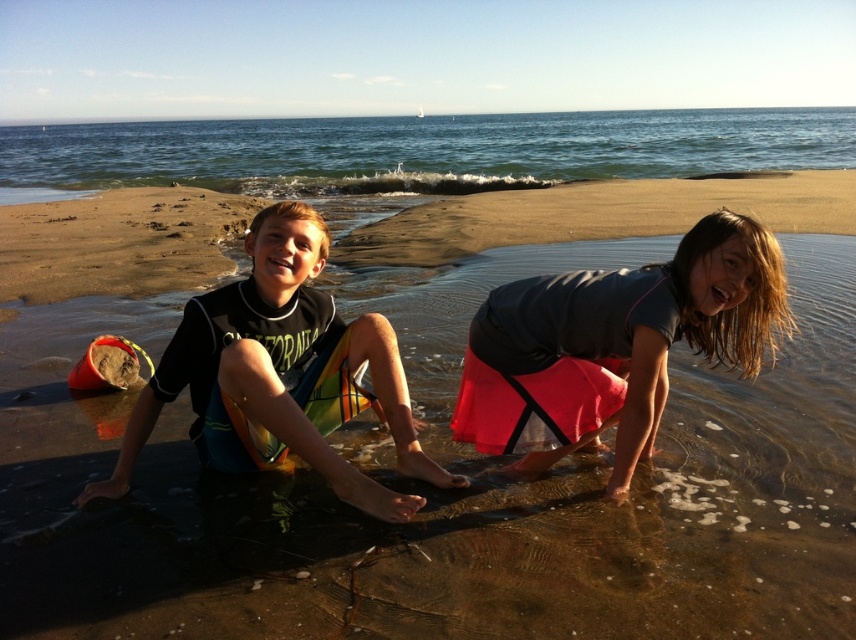
Question: Can you confirm if green water at upper center is positioned to the right of black wetsuit at center?

Choices:
 (A) no
 (B) yes

Answer: (A)

Question: Can you confirm if smooth sand at lower center is smaller than black wetsuit at center?

Choices:
 (A) yes
 (B) no

Answer: (A)

Question: Which object appears farthest from the camera in this image?

Choices:
 (A) matte pink skirt at lower right
 (B) smooth sand at lower center
 (C) black wetsuit at center
 (D) green water at upper center

Answer: (D)

Question: Which object is farther from the camera taking this photo?

Choices:
 (A) smooth sand at lower center
 (B) black wetsuit at center

Answer: (A)

Question: Considering the relative positions of matte pink skirt at lower right and black wetsuit at center in the image provided, where is matte pink skirt at lower right located with respect to black wetsuit at center?

Choices:
 (A) right
 (B) left

Answer: (A)

Question: Which is farther from the smooth sand at lower center?

Choices:
 (A) black wetsuit at center
 (B) green water at upper center
 (C) matte pink skirt at lower right

Answer: (B)